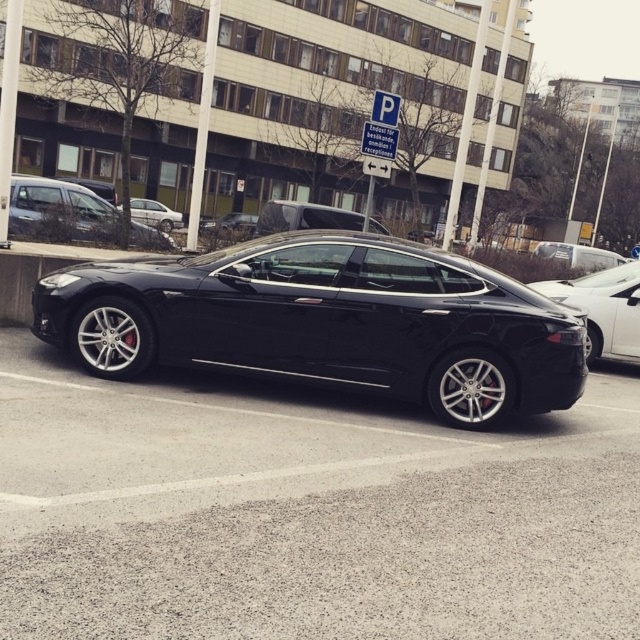
Is shiny silver sedan at center bigger than matte black car at center?

Actually, shiny silver sedan at center might be smaller than matte black car at center.

Between point (557, 296) and point (88, 232), which one is positioned in front?

Point (557, 296) is more forward.

Image resolution: width=640 pixels, height=640 pixels. In order to click on shiny silver sedan at center in this screenshot , I will do (604, 308).

Is shiny silver sedan at center positioned before silver metallic sedan at center?

Yes, shiny silver sedan at center is in front of silver metallic sedan at center.

This screenshot has width=640, height=640. In order to click on shiny silver sedan at center in this screenshot , I will do coord(604,308).

Identify the location of shiny silver sedan at center. (604, 308).

Looking at this image, is black glossy car at center taller than silver metallic sedan at center?

No, black glossy car at center is not taller than silver metallic sedan at center.

Is black glossy car at center smaller than silver metallic sedan at center?

Indeed, black glossy car at center has a smaller size compared to silver metallic sedan at center.

Where is `black glossy car at center`? The image size is (640, 640). black glossy car at center is located at coordinates (305, 513).